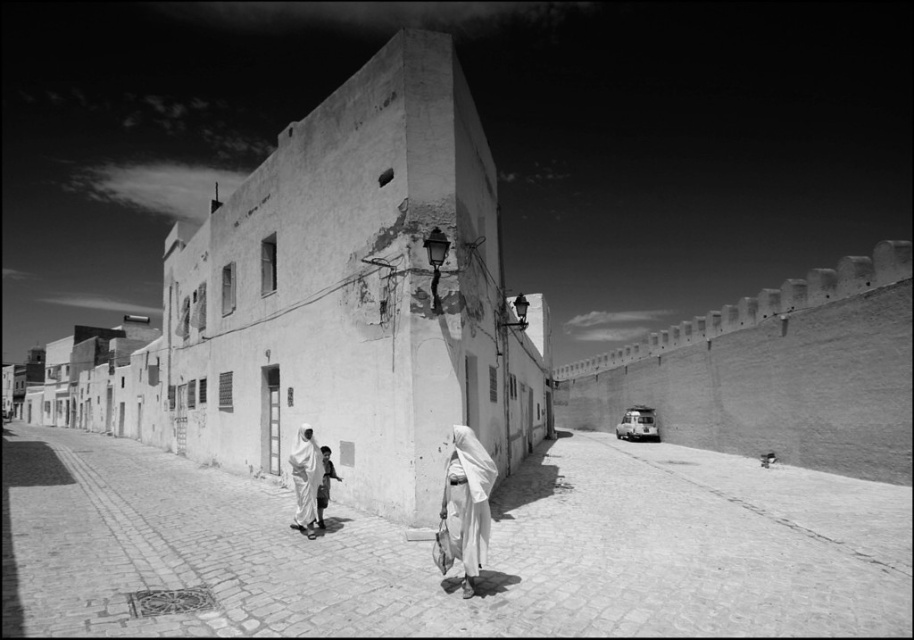
Question: Can you confirm if white cloth at center is positioned above white fabric headscarf at lower center?

Choices:
 (A) no
 (B) yes

Answer: (B)

Question: Which of the following is the farthest from the observer?

Choices:
 (A) (497, 570)
 (B) (482, 467)
 (C) (312, 518)

Answer: (C)

Question: Among these objects, which one is nearest to the camera?

Choices:
 (A) white cloth at center
 (B) white fabric headscarf at lower center
 (C) smooth stone alley at center

Answer: (C)

Question: Does smooth stone alley at center appear over white fabric headscarf at lower center?

Choices:
 (A) no
 (B) yes

Answer: (A)

Question: Which object is closer to the camera taking this photo?

Choices:
 (A) white fabric headscarf at lower center
 (B) smooth stone alley at center

Answer: (B)

Question: Observing the image, what is the correct spatial positioning of white cloth at center in reference to white fabric headscarf at lower center?

Choices:
 (A) left
 (B) right

Answer: (B)